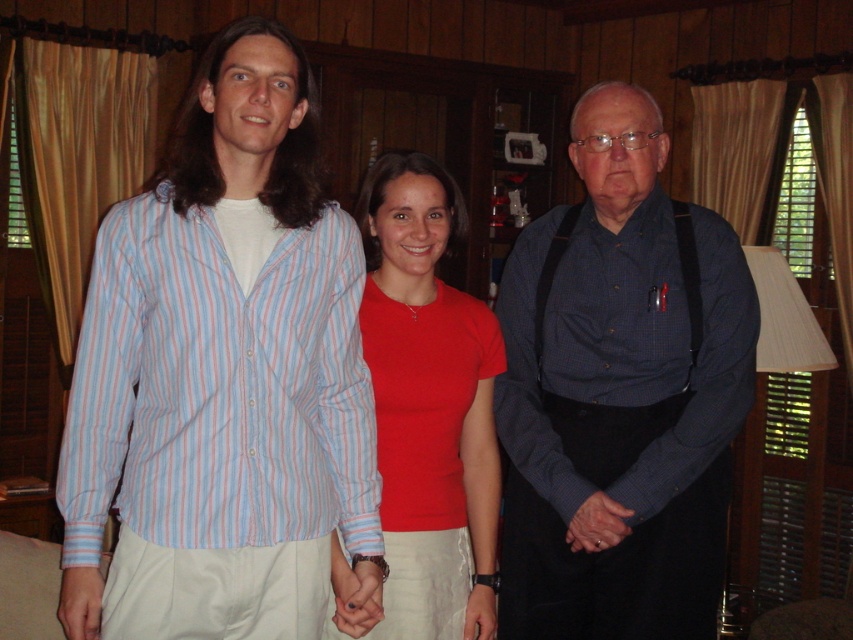
Question: Which object is the closest to the matte red shirt at center?

Choices:
 (A) light blue striped shirt at left
 (B) blue checkered shirt at center

Answer: (B)

Question: Considering the real-world distances, which object is closest to the light blue striped shirt at left?

Choices:
 (A) matte red shirt at center
 (B) blue checkered shirt at center

Answer: (A)

Question: Considering the relative positions of blue checkered shirt at center and matte red shirt at center in the image provided, where is blue checkered shirt at center located with respect to matte red shirt at center?

Choices:
 (A) left
 (B) right

Answer: (B)

Question: Which point appears closest to the camera in this image?

Choices:
 (A) (593, 502)
 (B) (373, 355)
 (C) (242, 307)

Answer: (C)

Question: In this image, where is light blue striped shirt at left located relative to matte red shirt at center?

Choices:
 (A) below
 (B) above

Answer: (B)

Question: Is light blue striped shirt at left bigger than matte red shirt at center?

Choices:
 (A) no
 (B) yes

Answer: (B)